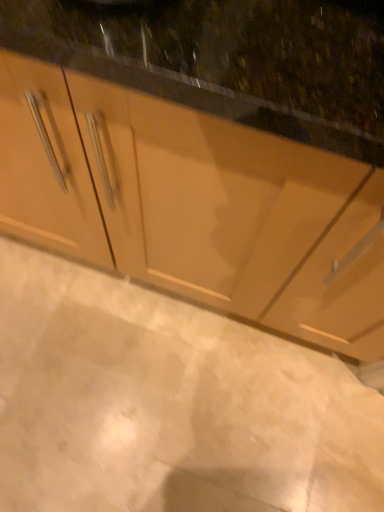
You are a GUI agent. You are given a task and a screenshot of the screen. Output one action in this format:
    pyautogui.click(x=<x>, y=<y>)
    Task: Click on the empty space that is ontop of white marble floor at lower center (from a real-world perspective)
    
    Given the screenshot: What is the action you would take?
    pyautogui.click(x=195, y=428)